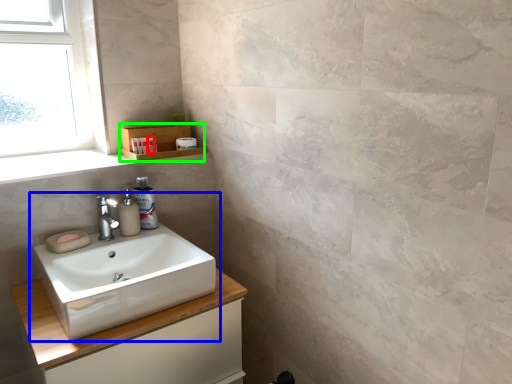
Question: Estimate the real-world distances between objects in this image. Which object is closer to toiletry (highlighted by a red box), sink (highlighted by a blue box) or shelf (highlighted by a green box)?

Choices:
 (A) sink
 (B) shelf

Answer: (B)